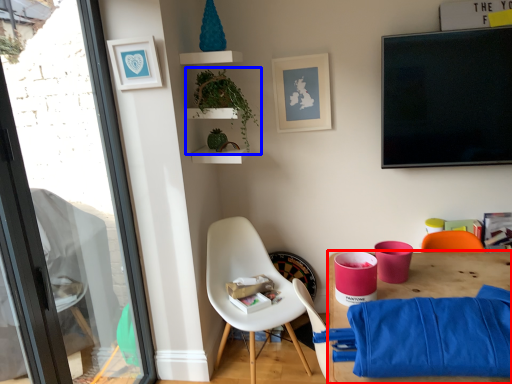
Question: Which object appears farthest to the camera in this image, desk (highlighted by a red box) or houseplant (highlighted by a blue box)?

Choices:
 (A) desk
 (B) houseplant

Answer: (B)